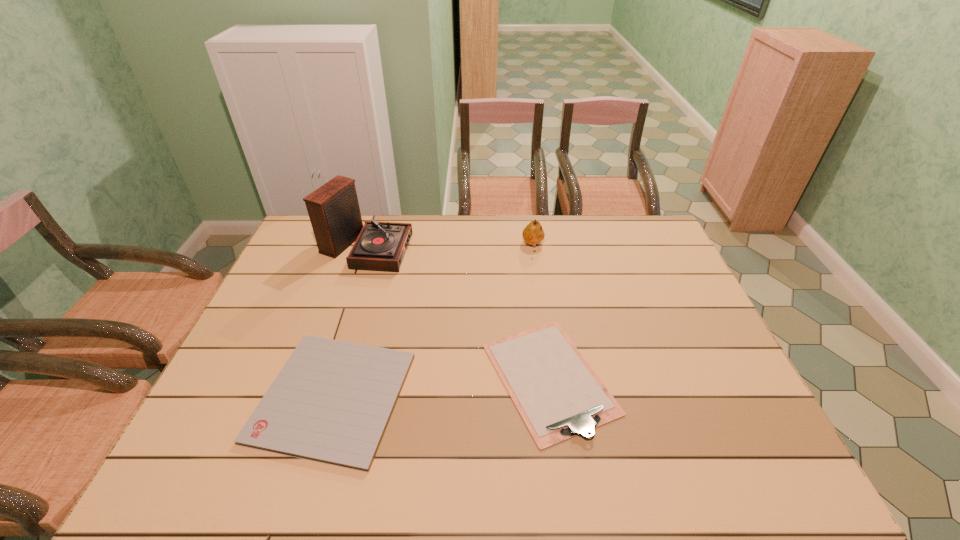
Find the location of `unoccupied position between the phonograph record and the right clipboard`. unoccupied position between the phonograph record and the right clipboard is located at coordinates (458, 312).

Select which object appears as the closest to the tallest object. Please provide its 2D coordinates. Your answer should be formatted as a tuple, i.e. [(x, y)], where the tuple contains the x and y coordinates of a point satisfying the conditions above.

[(331, 402)]

At what (x,y) coordinates should I click in order to perform the action: click on object that is the second closest one to the second shortest object. Please return your answer as a coordinate pair (x, y). Looking at the image, I should click on (533, 233).

Locate an element on the screen. This screenshot has width=960, height=540. free space that satisfies the following two spatial constraints: 1. on the front side of the phonograph record; 2. on the left side of the pear is located at coordinates (367, 246).

Locate an element on the screen. The image size is (960, 540). blank area in the image that satisfies the following two spatial constraints: 1. on the back side of the pear; 2. on the left side of the right clipboard is located at coordinates (530, 246).

Locate an element on the screen. This screenshot has height=540, width=960. vacant area that satisfies the following two spatial constraints: 1. on the back side of the second tallest object; 2. on the left side of the left clipboard is located at coordinates (377, 246).

Find the location of a particular element. This screenshot has height=540, width=960. vacant region that satisfies the following two spatial constraints: 1. on the front side of the phonograph record; 2. on the left side of the right clipboard is located at coordinates (324, 378).